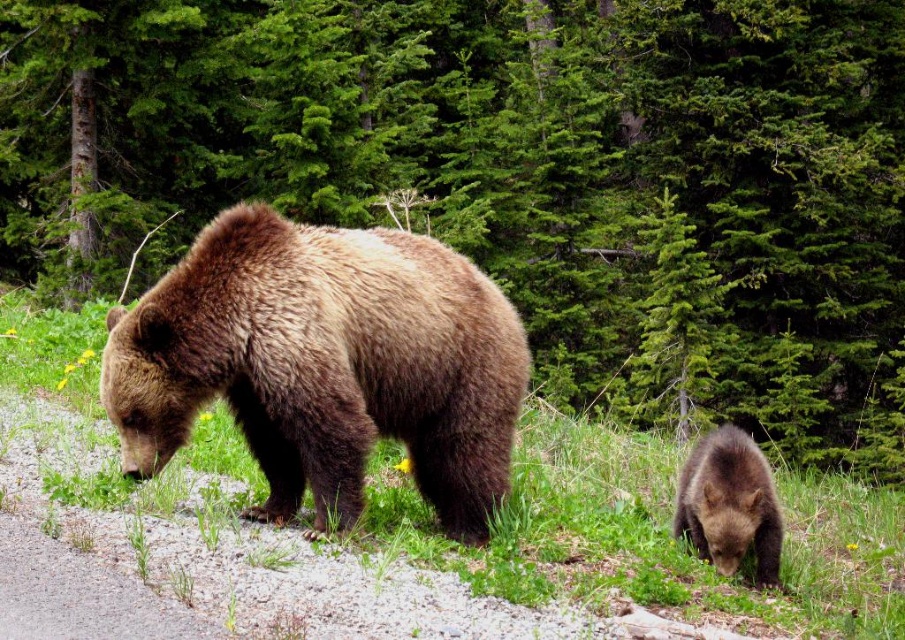
Is green soft grass at center positioned in front of brown furry bear at lower right?

Yes, green soft grass at center is in front of brown furry bear at lower right.

Which is above, green soft grass at center or brown furry bear at lower right?

Positioned higher is green soft grass at center.

Image resolution: width=905 pixels, height=640 pixels. Find the location of `green soft grass at center`. green soft grass at center is located at coordinates (653, 532).

What are the coordinates of `green soft grass at center` in the screenshot? It's located at (653, 532).

Is brown furry bear at center thinner than brown furry bear at lower right?

No, brown furry bear at center is not thinner than brown furry bear at lower right.

Can you confirm if brown furry bear at center is taller than brown furry bear at lower right?

Correct, brown furry bear at center is much taller as brown furry bear at lower right.

Is point (515, 369) behind point (746, 483)?

No, (515, 369) is in front of (746, 483).

What are the coordinates of `brown furry bear at center` in the screenshot? It's located at (324, 364).

Is point (157, 348) more distant than point (805, 634)?

No.

Between point (383, 236) and point (576, 572), which one is positioned behind?

The point (383, 236) is behind.

I want to click on brown furry bear at center, so click(x=324, y=364).